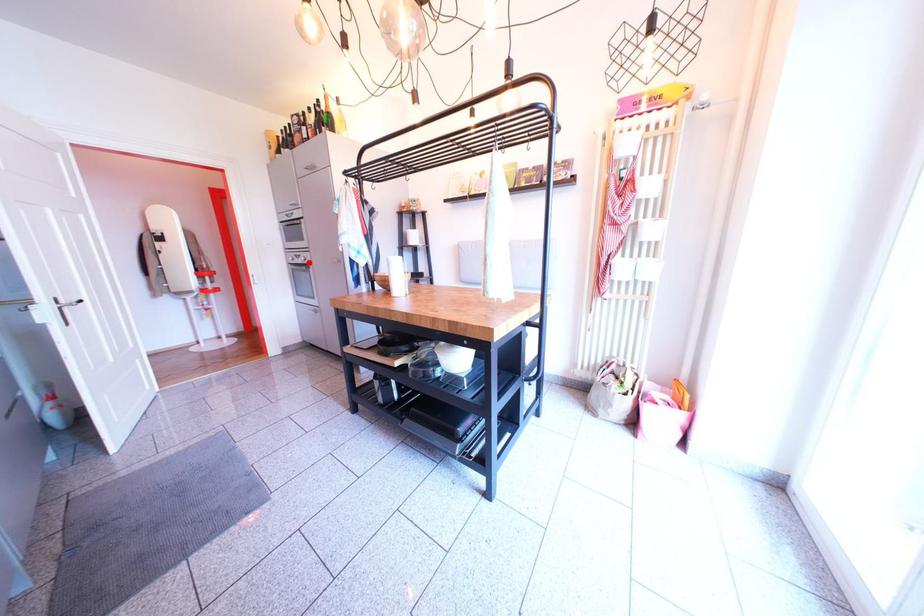
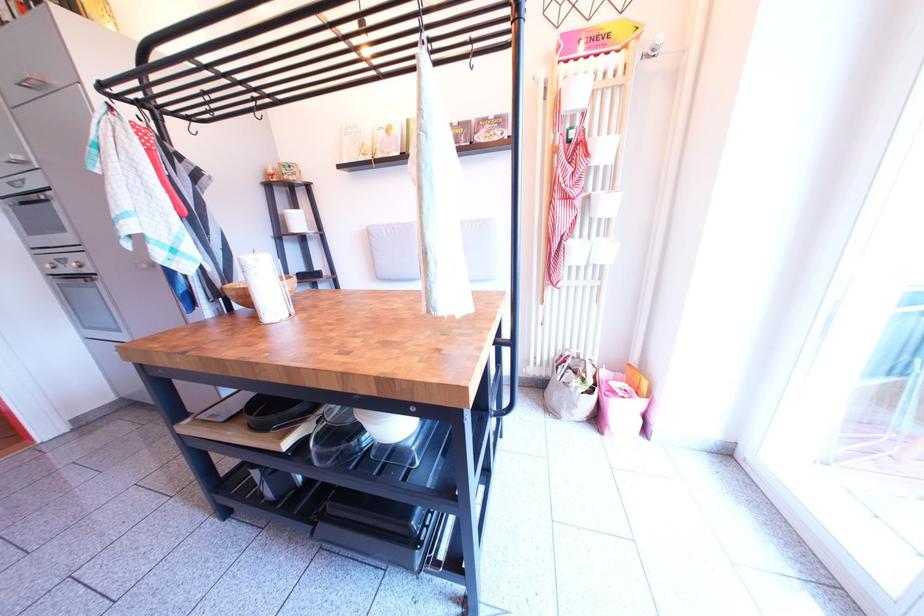
Question: I am providing you with two images of the same scene from different viewpoints. In image1, a red point is highlighted. Considering the same 3D point in image2, which of the following is correct?

Choices:
 (A) It is closer
 (B) It is farther

Answer: (B)